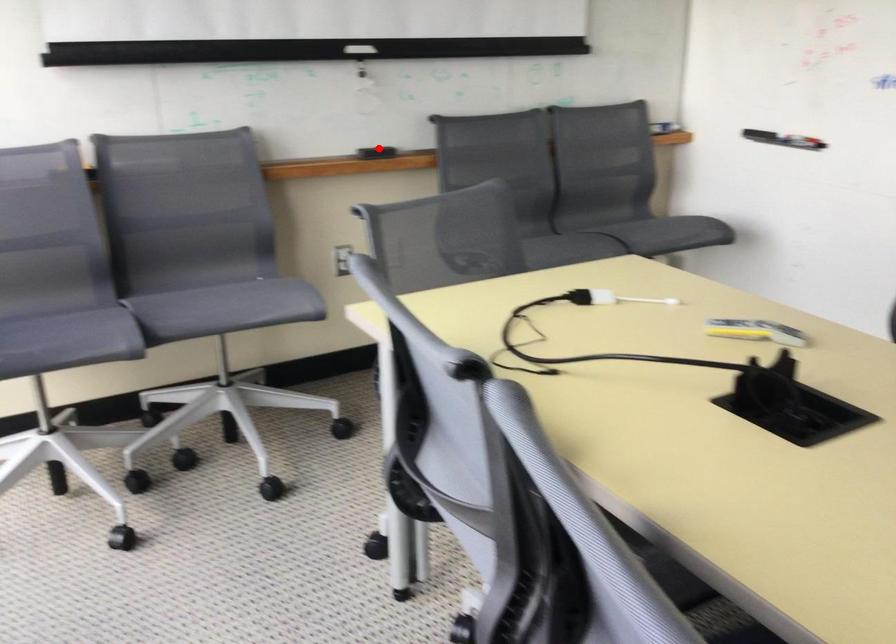
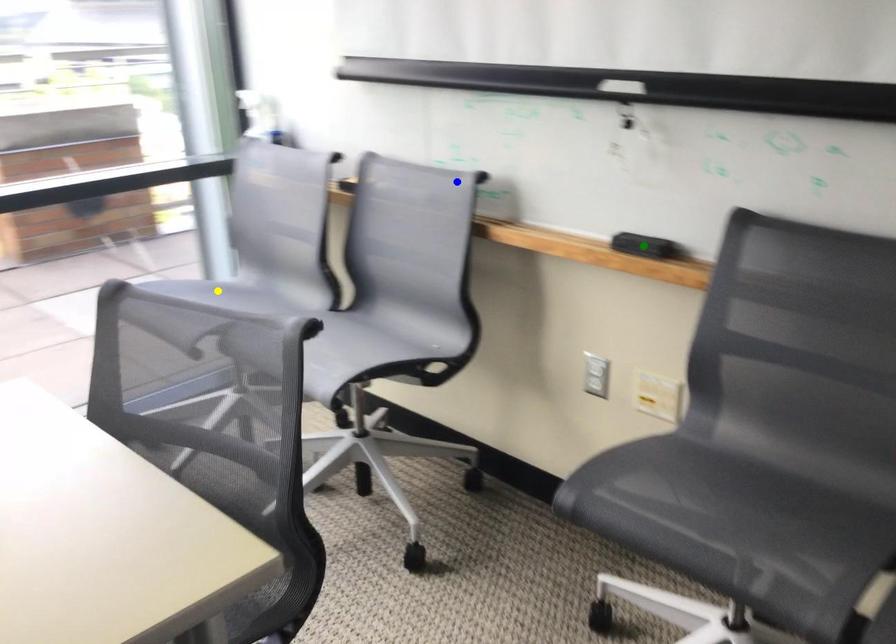
Question: I am providing you with two images of the same scene from different viewpoints. A red point is marked on the first image. You are given multiple points on the second image. Which point in image 2 represents the same 3d spot as the red point in image 1?

Choices:
 (A) green point
 (B) yellow point
 (C) blue point

Answer: (A)